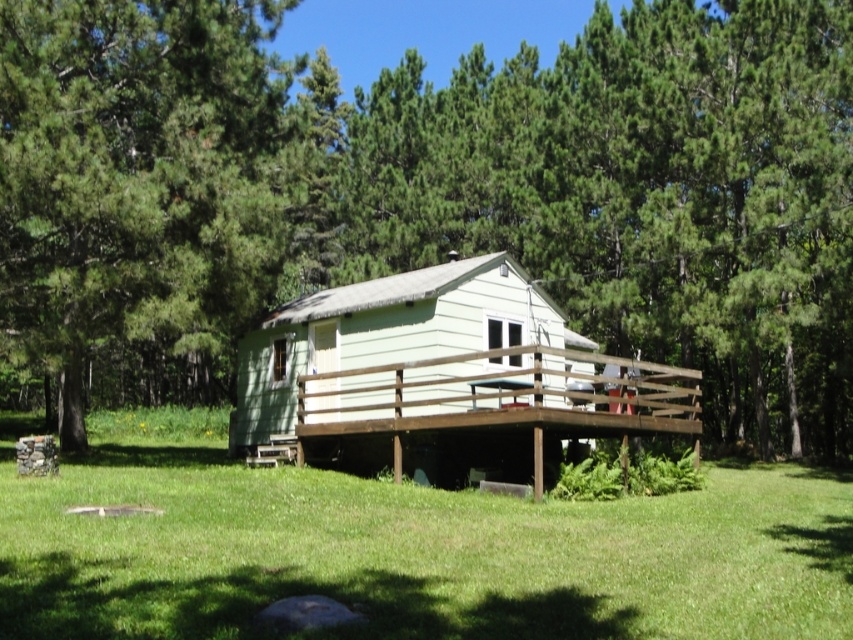
You are planning to install a small garden between the green leafy tree at center and the green textured tree at upper left. Based on their widths, which tree should you place closer to the garden to ensure enough space?

The green leafy tree at center might be wider than the green textured tree at upper left, so placing the wider tree farther from the garden would leave more space for the garden area.